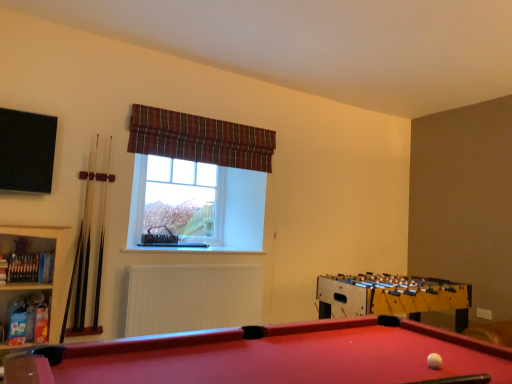
Question: Considering the positions of point (208, 142) and point (81, 329), is point (208, 142) closer or farther from the camera than point (81, 329)?

Choices:
 (A) farther
 (B) closer

Answer: (A)

Question: In terms of size, does plaid fabric curtain at upper center appear bigger or smaller than light brown wooden cue at left, the second cue in the right-to-left sequence?

Choices:
 (A) big
 (B) small

Answer: (A)

Question: Which of these objects is positioned farthest from the black matte screen at upper left?

Choices:
 (A) yellow wooden foosball table at right
 (B) clear glass window at center
 (C) plaid fabric curtain at upper center
 (D) light brown wooden cue at left, the second cue in the right-to-left sequence
 (E) white wood cue at left, positioned as the second cue in left-to-right order

Answer: (A)

Question: Which of these objects is positioned farthest from the white matte ball at lower right?

Choices:
 (A) yellow wooden foosball table at right
 (B) rubberized felt pool table at lower left
 (C) black matte screen at upper left
 (D) plaid fabric curtain at upper center
 (E) clear glass window at center

Answer: (E)